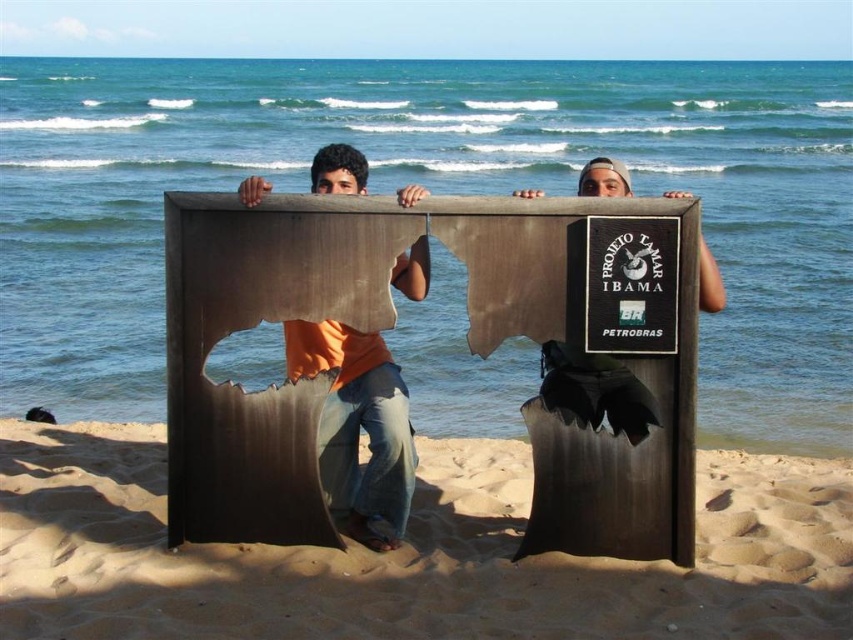
Question: Estimate the real-world distances between objects in this image. Which object is closer to the sandy brown sand at lower center?

Choices:
 (A) black cardboard sign at center
 (B) orange fabric at center

Answer: (B)

Question: Which object is positioned closest to the sandy brown sand at lower center?

Choices:
 (A) black cardboard sign at center
 (B) orange fabric at center

Answer: (B)

Question: Based on their relative distances, which object is nearer to the sandy brown sand at lower center?

Choices:
 (A) orange fabric at center
 (B) black cardboard sign at center

Answer: (A)

Question: Is sandy brown sand at lower center wider than black cardboard sign at center?

Choices:
 (A) no
 (B) yes

Answer: (B)

Question: Can you confirm if sandy brown sand at lower center is positioned below orange fabric at center?

Choices:
 (A) yes
 (B) no

Answer: (A)

Question: Is orange fabric at center bigger than black cardboard sign at center?

Choices:
 (A) no
 (B) yes

Answer: (B)